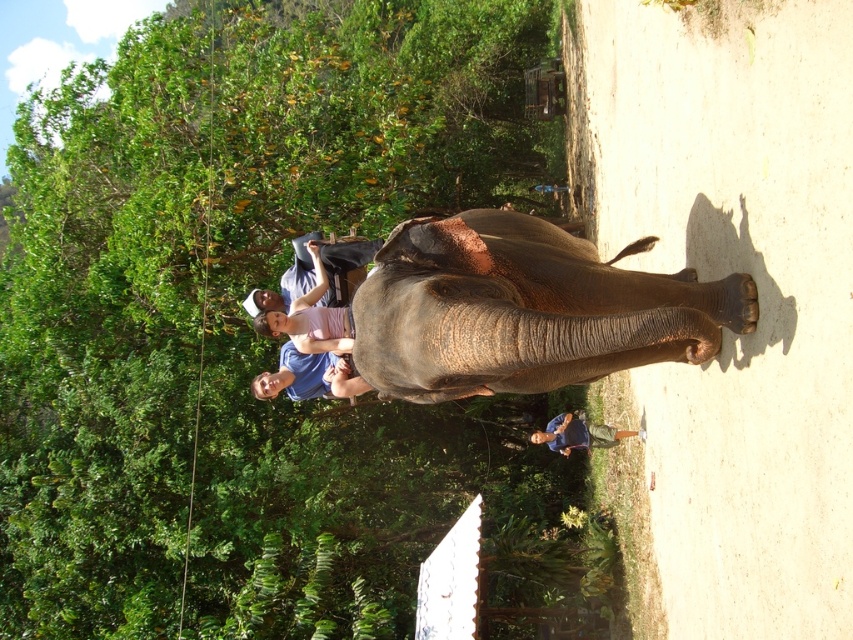
You are a photographer standing in the scene and want to capture a photo of the blue fabric shirt at center without the green leafy tree at upper left blocking it. What should you do?

The green leafy tree at upper left is closer to the viewer than the blue fabric shirt at center, so you should move your position to the right or left to avoid the tree blocking the view of the shirt.

You are a photographer trying to capture a clear photo of the gray textured elephant at center and the matte blue shirt at center. Since you want to focus on the elephant, which object should you zoom in on more and why?

You should zoom in more on the gray textured elephant at center because it is bigger than the matte blue shirt at center, making it the primary subject for focus.

You are a photographer standing on the dirt path. You want to take a photo of the gray textured elephant at center and the matte blue shirt at center. Which one should you focus on first if you want to capture both clearly in your photo?

The gray textured elephant at center is located above the matte blue shirt at center, so you should focus on the matte blue shirt at center first to ensure both are in focus since the elephant is farther away.